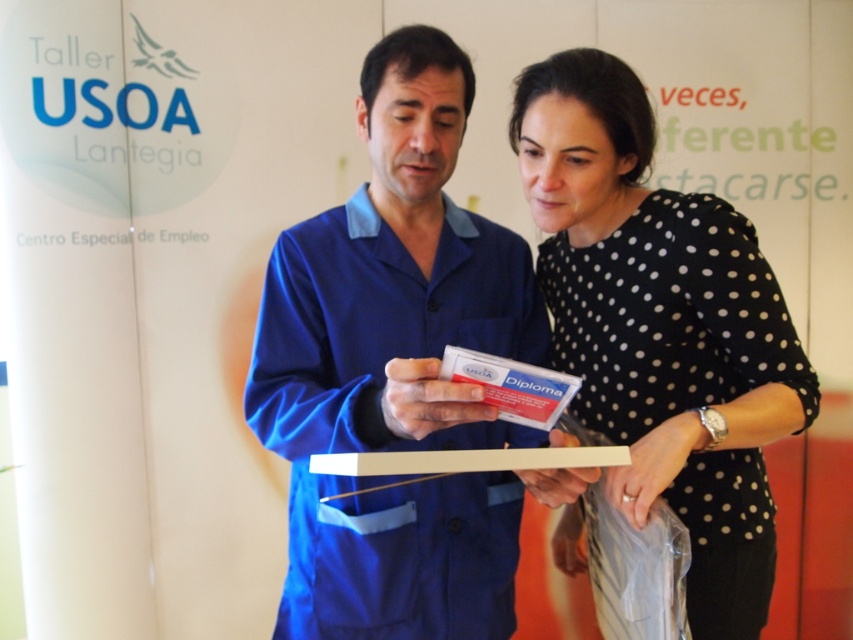
Is blue fabric shirt at center smaller than black dotted shirt at center?

Correct, blue fabric shirt at center occupies less space than black dotted shirt at center.

Who is positioned more to the left, blue fabric shirt at center or black dotted shirt at center?

blue fabric shirt at center is more to the left.

Which is behind, point (439, 83) or point (711, 483)?

Point (711, 483)

Where is `blue fabric shirt at center`? blue fabric shirt at center is located at coordinates (398, 372).